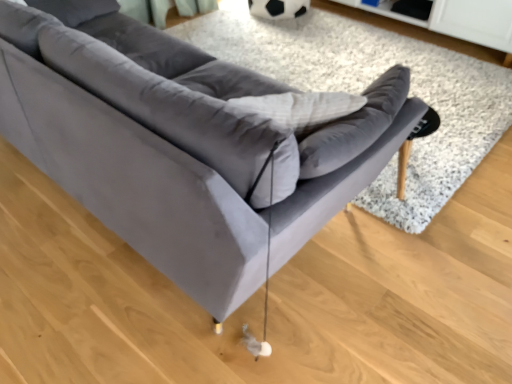
Question: Would you say velvet gray sofa at center is to the left or to the right of velvet gray couch at center in the picture?

Choices:
 (A) left
 (B) right

Answer: (B)

Question: Based on their sizes in the image, would you say velvet gray sofa at center is bigger or smaller than velvet gray couch at center?

Choices:
 (A) small
 (B) big

Answer: (A)

Question: From the image's perspective, is velvet gray sofa at center above or below velvet gray couch at center?

Choices:
 (A) above
 (B) below

Answer: (A)

Question: Considering the positions of point (128, 104) and point (476, 130), is point (128, 104) closer or farther from the camera than point (476, 130)?

Choices:
 (A) closer
 (B) farther

Answer: (A)

Question: From the image's perspective, is velvet gray couch at center above or below velvet gray sofa at center?

Choices:
 (A) above
 (B) below

Answer: (B)

Question: Looking at their shapes, would you say velvet gray couch at center is wider or thinner than velvet gray sofa at center?

Choices:
 (A) thin
 (B) wide

Answer: (A)

Question: Relative to velvet gray sofa at center, is velvet gray couch at center in front or behind?

Choices:
 (A) behind
 (B) front

Answer: (B)